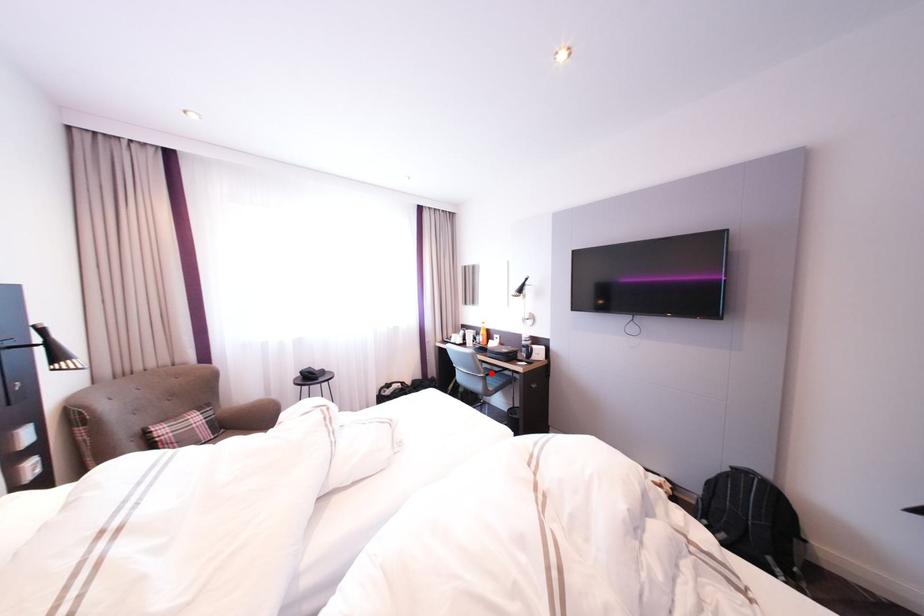
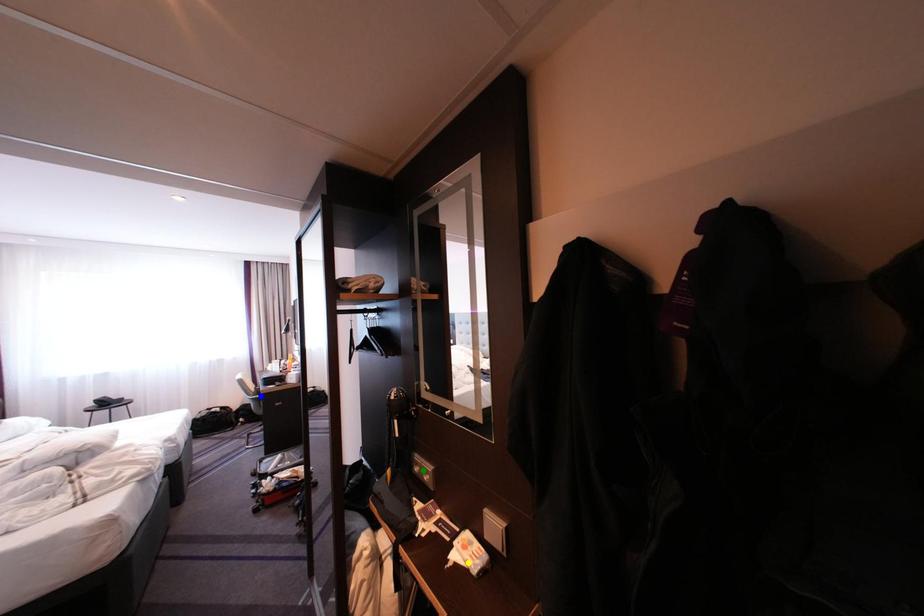
Question: I am providing you with two images of the same scene from different viewpoints. A red point is marked on the first image. You are given multiple points on the second image. In image 2, which mark is for the same physical point as the one in image 1?

Choices:
 (A) green point
 (B) blue point
 (C) yellow point

Answer: (B)